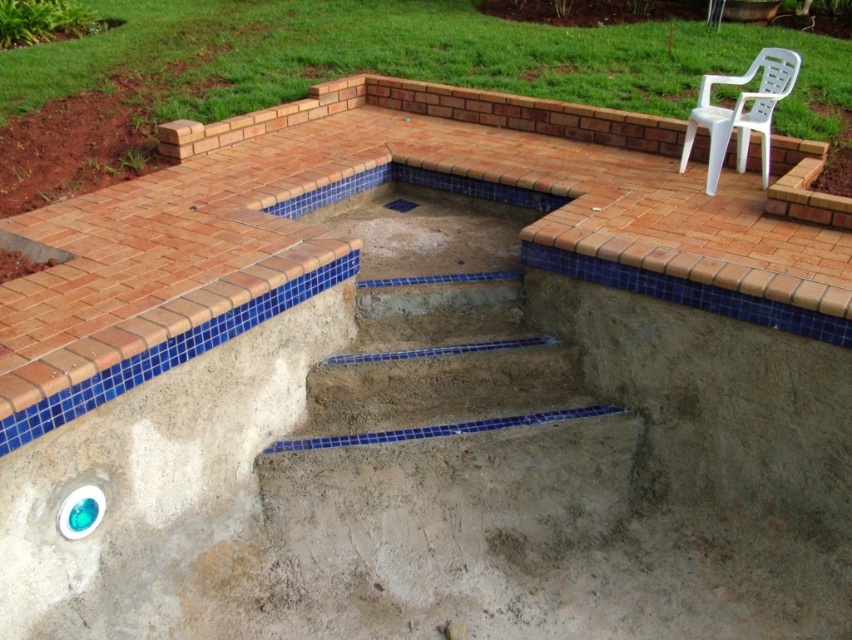
The image size is (852, 640). What do you see at coordinates (349, 74) in the screenshot? I see `concrete steps at center` at bounding box center [349, 74].

Is point (338, 74) positioned before point (729, 116)?

No, it is not.

The height and width of the screenshot is (640, 852). I want to click on concrete steps at center, so click(x=349, y=74).

Between point (108, 100) and point (426, 202), which one is positioned behind?

The point (108, 100) is more distant.

Does point (394, 42) lie behind point (471, 221)?

Yes.

At what (x,y) coordinates should I click in order to perform the action: click on concrete steps at center. Please return your answer as a coordinate pair (x, y). Looking at the image, I should click on (349, 74).

Does blue mosaic tiles at center appear under white plastic chair at upper right?

Correct, blue mosaic tiles at center is located below white plastic chair at upper right.

Between point (550, 200) and point (695, 104), which one is positioned behind?

The point (695, 104) is more distant.

Identify the location of blue mosaic tiles at center. Image resolution: width=852 pixels, height=640 pixels. (426, 218).